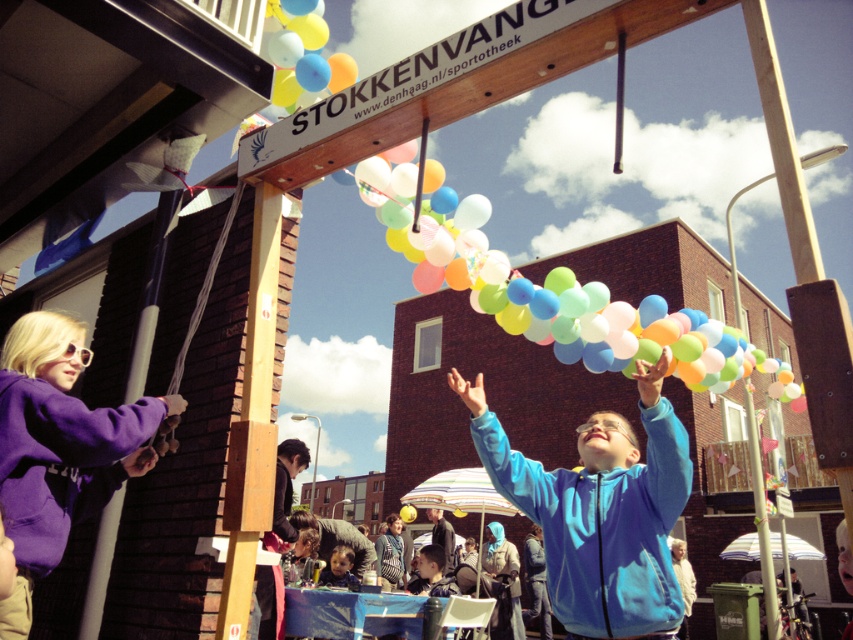
Question: Can you confirm if pastel balloons at center is positioned to the right of matte blue hoodie at center?

Choices:
 (A) no
 (B) yes

Answer: (B)

Question: Is blue matte jacket at center closer to camera compared to matte blue hoodie at center?

Choices:
 (A) yes
 (B) no

Answer: (A)

Question: Which point is closer to the camera taking this photo?

Choices:
 (A) (642, 413)
 (B) (347, 556)

Answer: (A)

Question: Does blue matte jacket at center appear on the left side of pastel balloons at center?

Choices:
 (A) no
 (B) yes

Answer: (B)

Question: Which object is positioned closest to the pastel balloons at center?

Choices:
 (A) blue matte jacket at center
 (B) matte blue hoodie at center

Answer: (A)

Question: Among these points, which one is nearest to the camera?

Choices:
 (A) (590, 563)
 (B) (318, 582)
 (C) (431, 285)

Answer: (A)